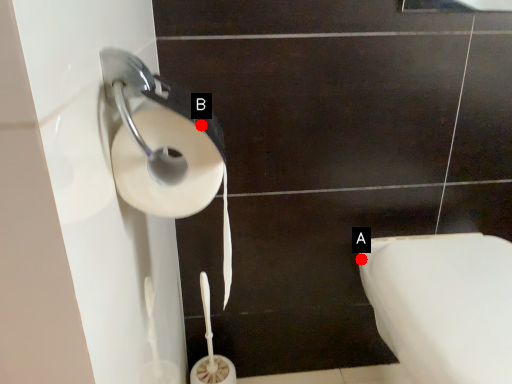
Question: Two points are circled on the image, labeled by A and B beside each circle. Which point appears closest to the camera in this image?

Choices:
 (A) A is closer
 (B) B is closer

Answer: (B)